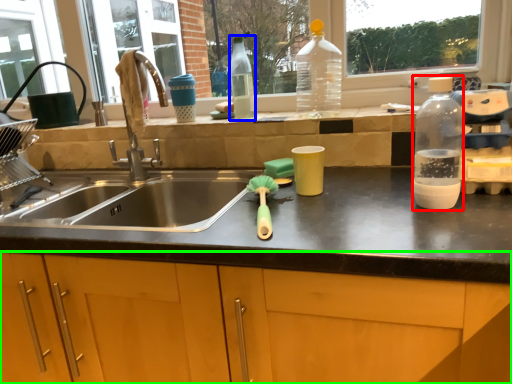
Question: Which object is the closest to the bottle (highlighted by a red box)? Choose among these: bottle (highlighted by a blue box) or cabinetry (highlighted by a green box).

Choices:
 (A) bottle
 (B) cabinetry

Answer: (B)